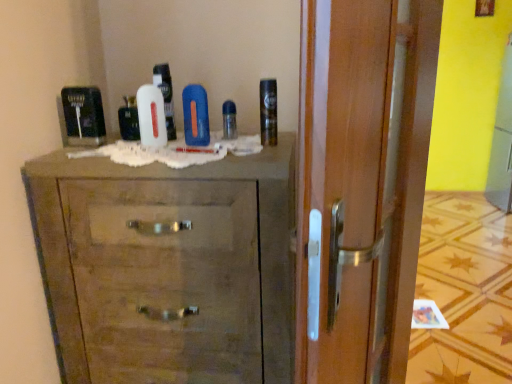
Question: From the image's perspective, is blue matte bottle at center located above white glossy mouthwash at center, placed as the 1th mouthwash when sorted from left to right?

Choices:
 (A) yes
 (B) no

Answer: (B)

Question: Can you confirm if blue matte bottle at center is smaller than white glossy mouthwash at center, which is the 2th mouthwash from right to left?

Choices:
 (A) yes
 (B) no

Answer: (B)

Question: Does blue matte bottle at center appear on the right side of white glossy mouthwash at center, which is the 2th mouthwash from right to left?

Choices:
 (A) yes
 (B) no

Answer: (A)

Question: From the image's perspective, is blue matte bottle at center beneath white glossy mouthwash at center, placed as the 1th mouthwash when sorted from left to right?

Choices:
 (A) yes
 (B) no

Answer: (A)

Question: Is blue matte bottle at center closer to the viewer compared to white glossy mouthwash at center, placed as the 1th mouthwash when sorted from left to right?

Choices:
 (A) no
 (B) yes

Answer: (B)

Question: Is blue matte bottle at center not close to white glossy mouthwash at center, placed as the 1th mouthwash when sorted from left to right?

Choices:
 (A) no
 (B) yes

Answer: (A)

Question: Is white matte shaving cream at center, the second shaving cream in the left-to-right sequence, oriented towards white glossy mouthwash at center, placed as the 1th mouthwash when sorted from left to right?

Choices:
 (A) yes
 (B) no

Answer: (B)

Question: Can white glossy mouthwash at center, placed as the 1th mouthwash when sorted from left to right, be found inside white matte shaving cream at center, the second shaving cream in the left-to-right sequence?

Choices:
 (A) yes
 (B) no

Answer: (B)

Question: Considering the relative sizes of white matte shaving cream at center, the 2th shaving cream positioned from the right, and white glossy mouthwash at center, placed as the 1th mouthwash when sorted from left to right, in the image provided, is white matte shaving cream at center, the 2th shaving cream positioned from the right, thinner than white glossy mouthwash at center, placed as the 1th mouthwash when sorted from left to right,?

Choices:
 (A) no
 (B) yes

Answer: (A)

Question: Is white matte shaving cream at center, the 2th shaving cream positioned from the right, with white glossy mouthwash at center, which is the 2th mouthwash from right to left?

Choices:
 (A) no
 (B) yes

Answer: (A)

Question: Is white matte shaving cream at center, the 2th shaving cream positioned from the right, shorter than white glossy mouthwash at center, which is the 2th mouthwash from right to left?

Choices:
 (A) yes
 (B) no

Answer: (B)

Question: Is white matte shaving cream at center, the second shaving cream in the left-to-right sequence, in front of white glossy mouthwash at center, which is the 2th mouthwash from right to left?

Choices:
 (A) yes
 (B) no

Answer: (A)

Question: Does white matte shaving cream at center, acting as the third shaving cream starting from the right, have a greater height compared to shiny metallic can at upper right, positioned as the 3th shaving cream in left-to-right order?

Choices:
 (A) yes
 (B) no

Answer: (B)